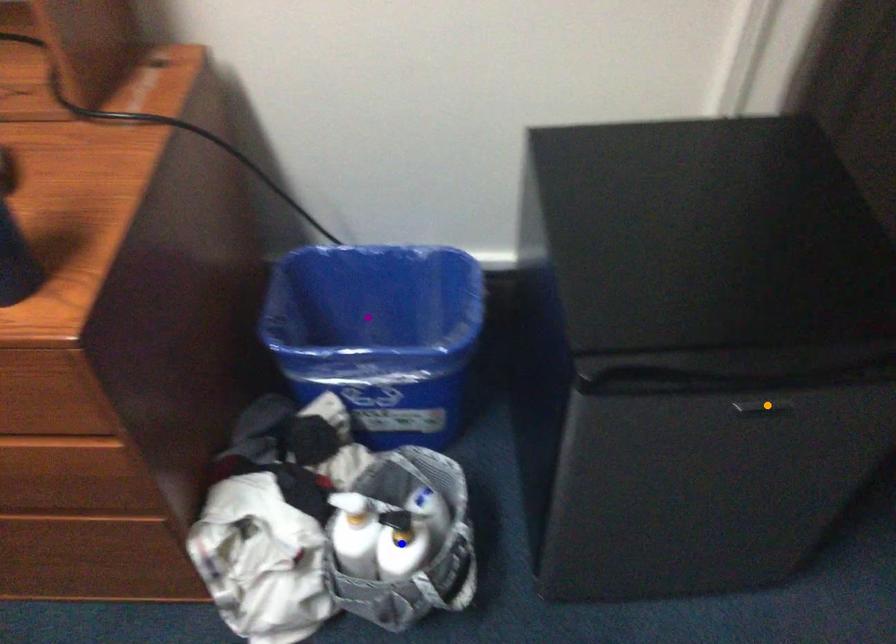
Order these from nearest to farthest:
- orange point
- purple point
- blue point

orange point
blue point
purple point